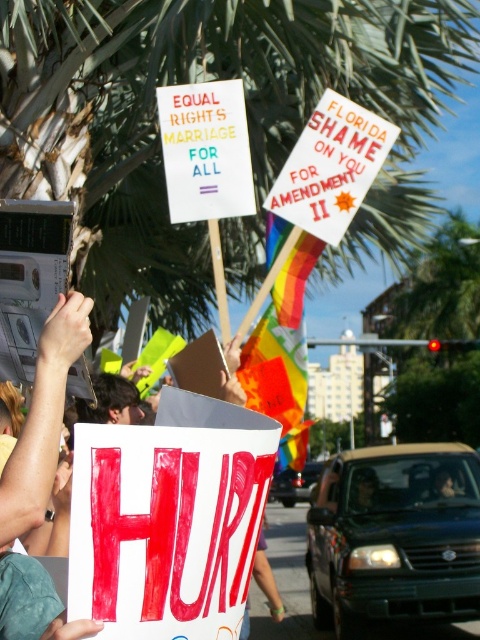
You are a photographer standing in the middle of the protest area. You want to take a photo that includes both the green leafy palm tree at upper center and the white paper sign at upper center. Considering the distance between them, will you be able to fit both into your camera frame if your camera has a maximum horizontal field of view of 18 feet?

The distance between the green leafy palm tree at upper center and the white paper sign at upper center is 18.52 feet, which exceeds the camera frame of 18 feet. Therefore, you cannot fit both into the frame.

In the scene shown: You are a photographer trying to capture both the white paper sign at center and the white paper sign at upper center in a single frame. Which sign should you adjust your camera angle to focus on first to ensure both fit in the frame, considering their sizes?

The white paper sign at center is smaller than the white paper sign at upper center, so you should focus on the larger white paper sign at upper center first to ensure both fit in the frame.